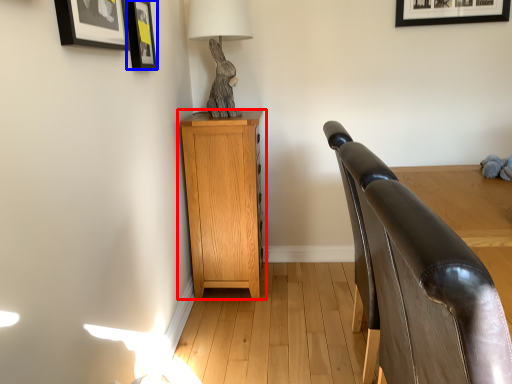
Question: Which object is closer to the camera taking this photo, nightstand (highlighted by a red box) or picture frame (highlighted by a blue box)?

Choices:
 (A) nightstand
 (B) picture frame

Answer: (B)